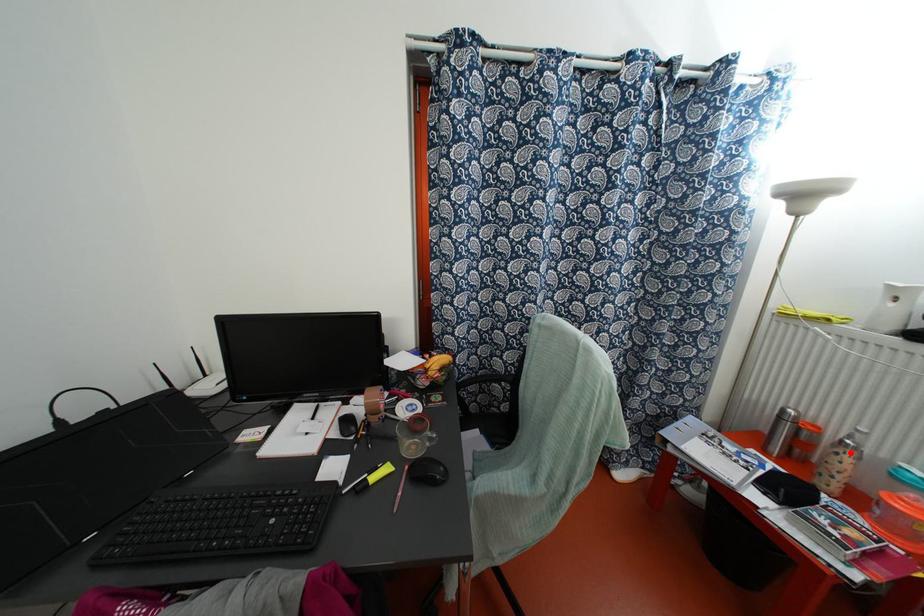
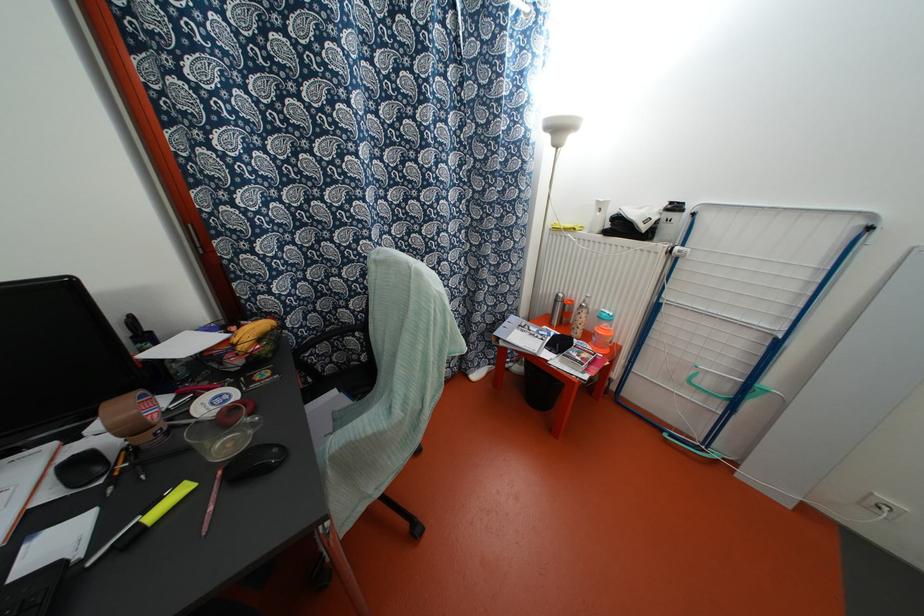
Find the pixel in the second image that matches the highlighted location in the first image.

(584, 310)